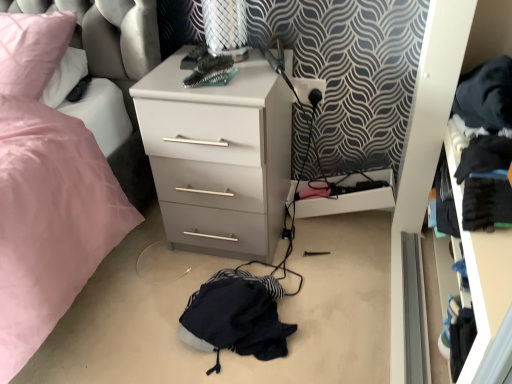
At what (x,y) coordinates should I click in order to perform the action: click on vacant area that lies between matte gray chest of drawers at center and dark blue fabric at center. Please return your answer as a coordinate pair (x, y). Looking at the image, I should click on (200, 271).